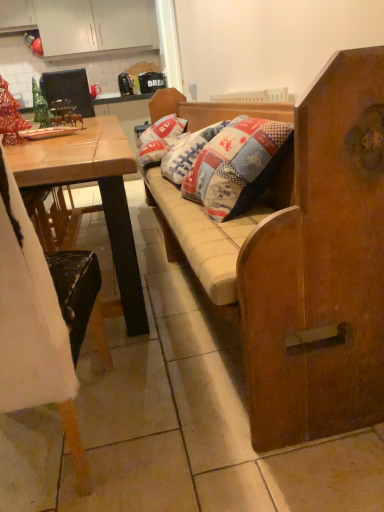
What are the coordinates of `free space to the right of wooden chair at left` in the screenshot? It's located at (172, 421).